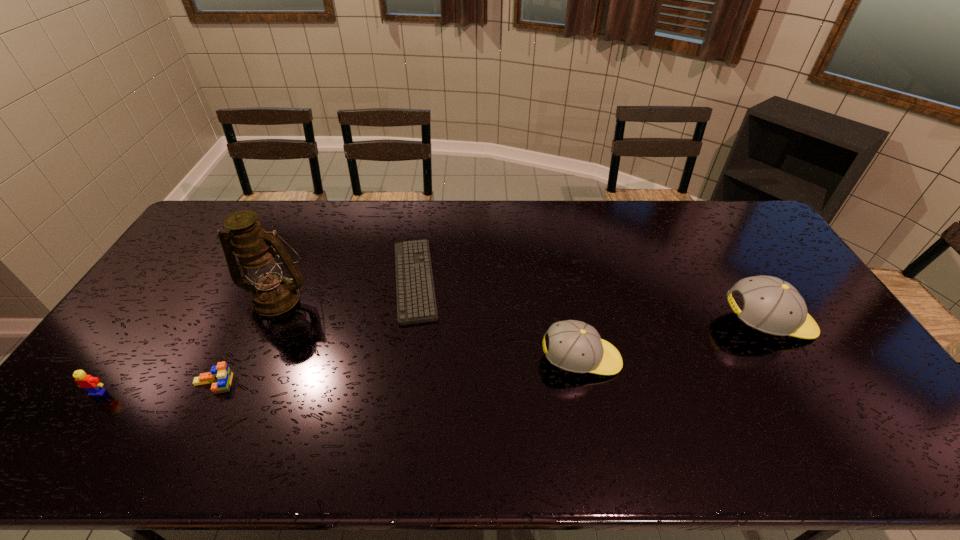
Locate an element on the screen. This screenshot has width=960, height=540. free space between the taller Lego and the tallest object is located at coordinates (188, 345).

Find the location of a particular element. The width and height of the screenshot is (960, 540). free spot between the second tallest object and the left Lego is located at coordinates (433, 357).

At what (x,y) coordinates should I click in order to perform the action: click on vacant area that lies between the left Lego and the shortest object. Please return your answer as a coordinate pair (x, y). Looking at the image, I should click on (256, 336).

I want to click on object identified as the closest to the leftmost object, so click(x=221, y=373).

Identify which object is the fifth nearest to the oil lamp. Please provide its 2D coordinates. Your answer should be formatted as a tuple, i.e. [(x, y)], where the tuple contains the x and y coordinates of a point satisfying the conditions above.

[(773, 306)]

Image resolution: width=960 pixels, height=540 pixels. What are the coordinates of `free location that satisfies the following two spatial constraints: 1. on the front-facing side of the right baseball cap; 2. on the front-facing side of the fourth tallest object` in the screenshot? It's located at (810, 393).

The height and width of the screenshot is (540, 960). I want to click on free location that satisfies the following two spatial constraints: 1. on the front-facing side of the taller baseball cap; 2. on the front-facing side of the third shortest object, so [x=810, y=393].